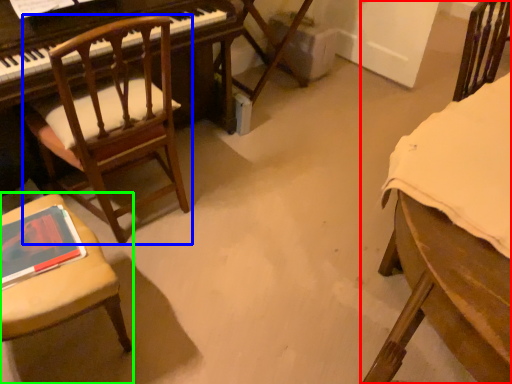
Question: Based on their relative distances, which object is farther from chair (highlighted by a red box)? Choose from chair (highlighted by a blue box) and chair (highlighted by a green box).

Choices:
 (A) chair
 (B) chair

Answer: (A)